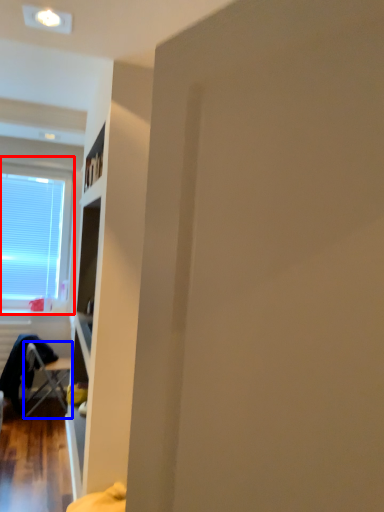
Question: Which object appears closest to the camera in this image, window (highlighted by a red box) or chair (highlighted by a blue box)?

Choices:
 (A) window
 (B) chair

Answer: (B)